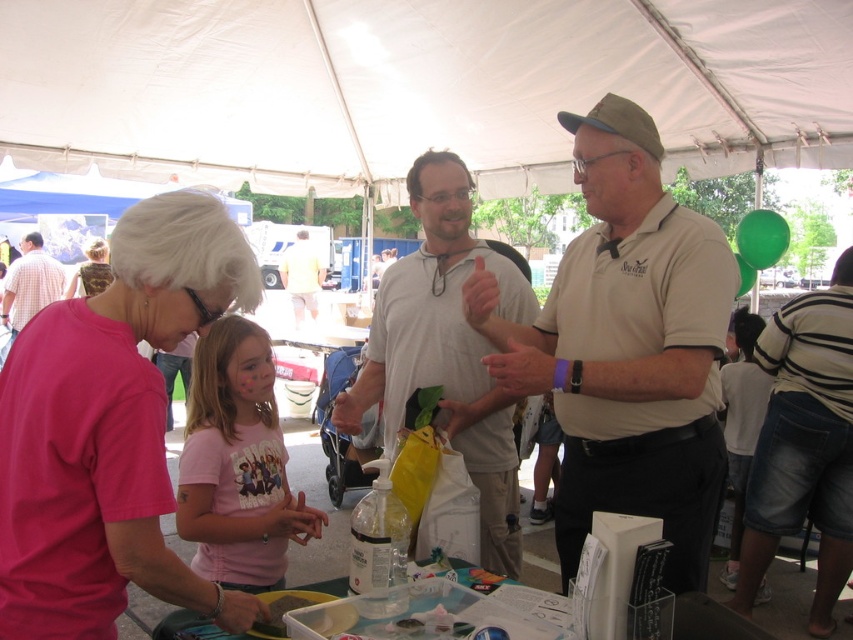
Who is more distant from viewer, (241, 502) or (39, 273)?

The point (39, 273) is behind.

Between point (277, 557) and point (22, 284), which one is positioned in front?

Point (277, 557) is more forward.

Where is `pink cotton shirt at center`? This screenshot has height=640, width=853. pink cotton shirt at center is located at coordinates (236, 465).

Is striped shirt at center wider than camouflage fabric backpack at upper left?

Yes.

Is striped shirt at center bigger than camouflage fabric backpack at upper left?

Yes, striped shirt at center is bigger than camouflage fabric backpack at upper left.

Image resolution: width=853 pixels, height=640 pixels. Describe the element at coordinates (804, 444) in the screenshot. I see `striped shirt at center` at that location.

Find the location of `striped shirt at center`. striped shirt at center is located at coordinates (804, 444).

Can you confirm if pink fabric shirt at upper left is wider than light yellow shirt at center?

Incorrect, pink fabric shirt at upper left's width does not surpass light yellow shirt at center's.

Which is more to the left, pink fabric shirt at upper left or light yellow shirt at center?

From the viewer's perspective, light yellow shirt at center appears more on the left side.

What do you see at coordinates (109, 428) in the screenshot? The image size is (853, 640). I see `pink fabric shirt at upper left` at bounding box center [109, 428].

Find the location of `pink fabric shirt at upper left`. pink fabric shirt at upper left is located at coordinates (109, 428).